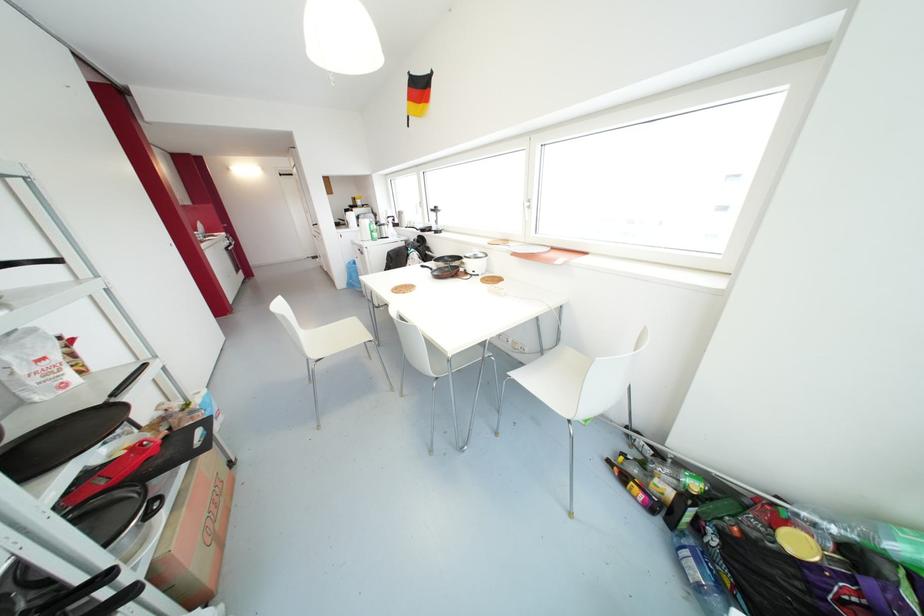
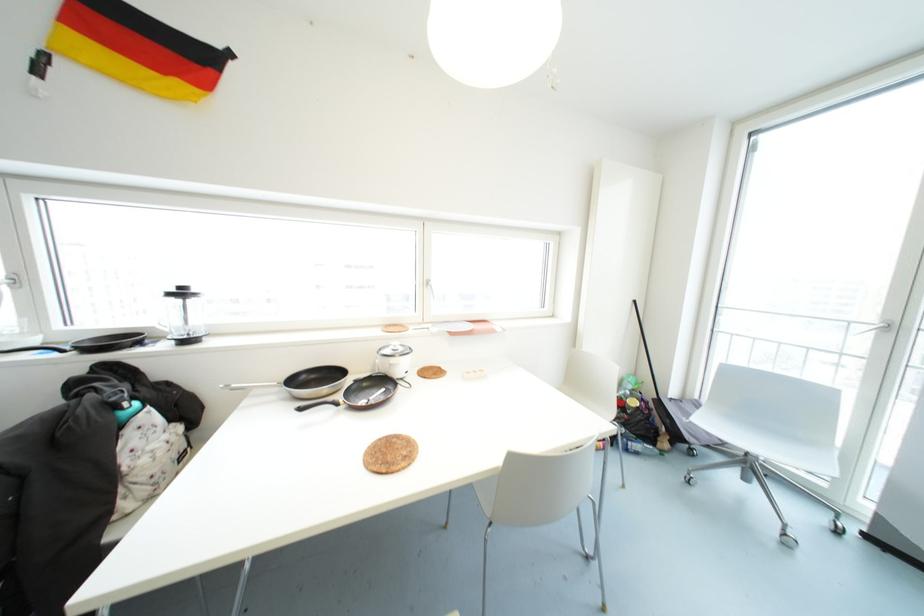
Find the pixel in the second image that matches the point at 506,240 in the first image.

(399, 325)